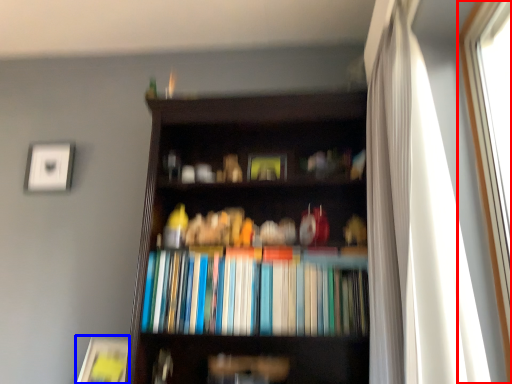
Question: Among these objects, which one is nearest to the camera, window (highlighted by a red box) or paperback book (highlighted by a blue box)?

Choices:
 (A) window
 (B) paperback book

Answer: (A)